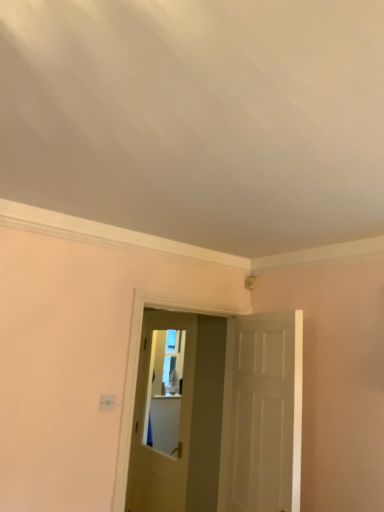
Where is `white matte door at center, which is the 1th door from front to back`? This screenshot has width=384, height=512. white matte door at center, which is the 1th door from front to back is located at coordinates (262, 414).

What do you see at coordinates (107, 402) in the screenshot? The width and height of the screenshot is (384, 512). I see `white plastic light switch at lower left` at bounding box center [107, 402].

What do you see at coordinates (171, 423) in the screenshot? This screenshot has width=384, height=512. I see `matte white door at center, which is counted as the 1th door, starting from the back` at bounding box center [171, 423].

The width and height of the screenshot is (384, 512). Identify the location of white matte door at center, which is the second door in left-to-right order. (262, 414).

Can you confirm if white matte door at center, which is counted as the 2th door, starting from the back, is bigger than matte white door at center, which is counted as the 1th door, starting from the back?

Incorrect, white matte door at center, which is counted as the 2th door, starting from the back, is not larger than matte white door at center, which is counted as the 1th door, starting from the back.

Which point is more forward, [285,428] or [137,473]?

The point [285,428] is more forward.

Is white matte door at center, which is counted as the 2th door, starting from the back, positioned in front of matte white door at center, which is counted as the 1th door, starting from the back?

Yes, white matte door at center, which is counted as the 2th door, starting from the back, is closer to the camera.

Measure the distance from white plastic light switch at lower left to matte white door at center, the first door when ordered from left to right.

white plastic light switch at lower left is 5.00 feet away from matte white door at center, the first door when ordered from left to right.

Is white plastic light switch at lower left positioned with its back to matte white door at center, which is counted as the 1th door, starting from the back?

That's not correct — white plastic light switch at lower left is not looking away from matte white door at center, which is counted as the 1th door, starting from the back.

Is white plastic light switch at lower left closer to the viewer compared to matte white door at center, which is counted as the 1th door, starting from the back?

That is True.

From the picture: Does white plastic light switch at lower left have a greater width compared to matte white door at center, positioned as the second door in front-to-back order?

No, white plastic light switch at lower left is not wider than matte white door at center, positioned as the second door in front-to-back order.

Is white matte door at center, which is the 1th door from front to back, in contact with white plastic light switch at lower left?

white matte door at center, which is the 1th door from front to back, is not next to white plastic light switch at lower left, and they're not touching.

In order to click on door in front of the white plastic light switch at lower left in this screenshot , I will do `click(262, 414)`.

Which object is wider, white matte door at center, which is the 1th door from front to back, or white plastic light switch at lower left?

Wider between the two is white matte door at center, which is the 1th door from front to back.

Which is in front, point (245, 382) or point (106, 411)?

The point (106, 411) is more forward.

Which is closer, (113, 403) or (231, 451)?

Point (113, 403) is closer to the camera than point (231, 451).

Is white plastic light switch at lower left taller than white matte door at center, which is the 1th door from front to back?

No, white plastic light switch at lower left is not taller than white matte door at center, which is the 1th door from front to back.

Which is correct: white plastic light switch at lower left is inside white matte door at center, which is the 1th door in right-to-left order, or outside of it?

white plastic light switch at lower left is not enclosed by white matte door at center, which is the 1th door in right-to-left order.

Could white plastic light switch at lower left be considered to be inside matte white door at center, the first door when ordered from left to right?

No.

From the white plastic light switch at lower left, count 1st door to the right and point to it. Please provide its 2D coordinates.

[(171, 423)]

In the image, is matte white door at center, which is counted as the 1th door, starting from the back, positioned in front of or behind white plastic light switch at lower left?

In the image, matte white door at center, which is counted as the 1th door, starting from the back, appears behind white plastic light switch at lower left.

Is matte white door at center, the first door when ordered from left to right, inside the boundaries of white matte door at center, which is the 1th door in right-to-left order, or outside?

matte white door at center, the first door when ordered from left to right, cannot be found inside white matte door at center, which is the 1th door in right-to-left order.

Considering the positions of objects matte white door at center, positioned as the second door in front-to-back order, and white matte door at center, which is the second door in left-to-right order, in the image provided, who is behind, matte white door at center, positioned as the second door in front-to-back order, or white matte door at center, which is the second door in left-to-right order,?

matte white door at center, positioned as the second door in front-to-back order.

Is white matte door at center, which is the second door in left-to-right order, at the back of matte white door at center, the first door when ordered from left to right?

No, white matte door at center, which is the second door in left-to-right order, is not at the back of matte white door at center, the first door when ordered from left to right.

This screenshot has height=512, width=384. What are the coordinates of `door lying behind the white matte door at center, which is the second door in left-to-right order` in the screenshot? It's located at (171, 423).

In order to click on light switch in front of the matte white door at center, the first door when ordered from left to right in this screenshot , I will do `click(107, 402)`.

Based on their spatial positions, is white matte door at center, which is the 1th door from front to back, or white plastic light switch at lower left further from matte white door at center, the second door when ordered from right to left?

The object further to matte white door at center, the second door when ordered from right to left, is white plastic light switch at lower left.

When comparing their distances from white plastic light switch at lower left, does white matte door at center, which is the second door in left-to-right order, or matte white door at center, the first door when ordered from left to right, seem further?

Among the two, matte white door at center, the first door when ordered from left to right, is located further to white plastic light switch at lower left.

Which object lies further to the anchor point white matte door at center, which is counted as the 2th door, starting from the back, matte white door at center, the first door when ordered from left to right, or white plastic light switch at lower left?

matte white door at center, the first door when ordered from left to right.

Considering their positions, is matte white door at center, which is counted as the 1th door, starting from the back, positioned closer to white plastic light switch at lower left than white matte door at center, which is counted as the 2th door, starting from the back?

Among the two, white matte door at center, which is counted as the 2th door, starting from the back, is located nearer to white plastic light switch at lower left.

Estimate the real-world distances between objects in this image. Which object is closer to matte white door at center, positioned as the second door in front-to-back order, white plastic light switch at lower left or white matte door at center, which is the 1th door from front to back?

Among the two, white matte door at center, which is the 1th door from front to back, is located nearer to matte white door at center, positioned as the second door in front-to-back order.

From the image, which object appears to be nearer to white matte door at center, which is the 1th door in right-to-left order, white plastic light switch at lower left or matte white door at center, the first door when ordered from left to right?

The object closer to white matte door at center, which is the 1th door in right-to-left order, is white plastic light switch at lower left.

At what (x,y) coordinates should I click in order to perform the action: click on light switch between white matte door at center, which is the second door in left-to-right order, and matte white door at center, the second door when ordered from right to left, from front to back. Please return your answer as a coordinate pair (x, y). This screenshot has height=512, width=384. Looking at the image, I should click on (107, 402).